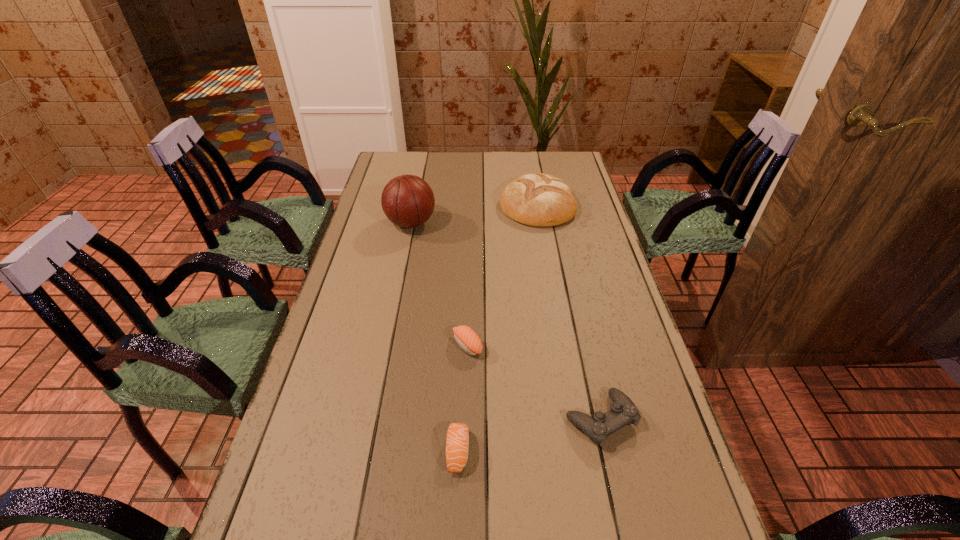
At what (x,y) coordinates should I click in order to perform the action: click on the tallest object. Please return your answer as a coordinate pair (x, y). This screenshot has height=540, width=960. Looking at the image, I should click on (408, 201).

Image resolution: width=960 pixels, height=540 pixels. In order to click on the leftmost object in this screenshot , I will do `click(408, 201)`.

Find the location of `the second tallest object`. the second tallest object is located at coordinates (539, 199).

You are a GUI agent. You are given a task and a screenshot of the screen. Output one action in this format:
    pyautogui.click(x=<x>, y=<y>)
    Task: Click on the taller sushi
    
    Given the screenshot: What is the action you would take?
    coord(467,339)

At what (x,y) coordinates should I click in order to perform the action: click on the farther sushi. Please return your answer as a coordinate pair (x, y). The width and height of the screenshot is (960, 540). Looking at the image, I should click on (467, 339).

Locate an element on the screen. The width and height of the screenshot is (960, 540). control is located at coordinates (623, 411).

I want to click on the nearer sushi, so click(457, 443).

Locate an element on the screen. The width and height of the screenshot is (960, 540). the shorter sushi is located at coordinates (457, 443).

Identify the location of free region located 0.230m on the right of the basketball. (501, 223).

Locate an element on the screen. vacant area located 0.110m on the front of the second tallest object is located at coordinates (545, 249).